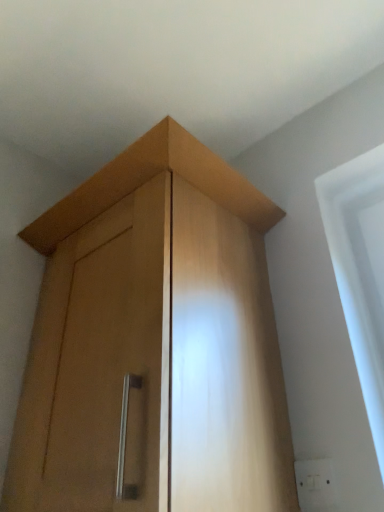
The height and width of the screenshot is (512, 384). What do you see at coordinates (154, 343) in the screenshot? I see `light wood cupboard at center` at bounding box center [154, 343].

The height and width of the screenshot is (512, 384). Identify the location of light wood cupboard at center. (154, 343).

The width and height of the screenshot is (384, 512). What are the coordinates of `light wood cupboard at center` in the screenshot? It's located at (154, 343).